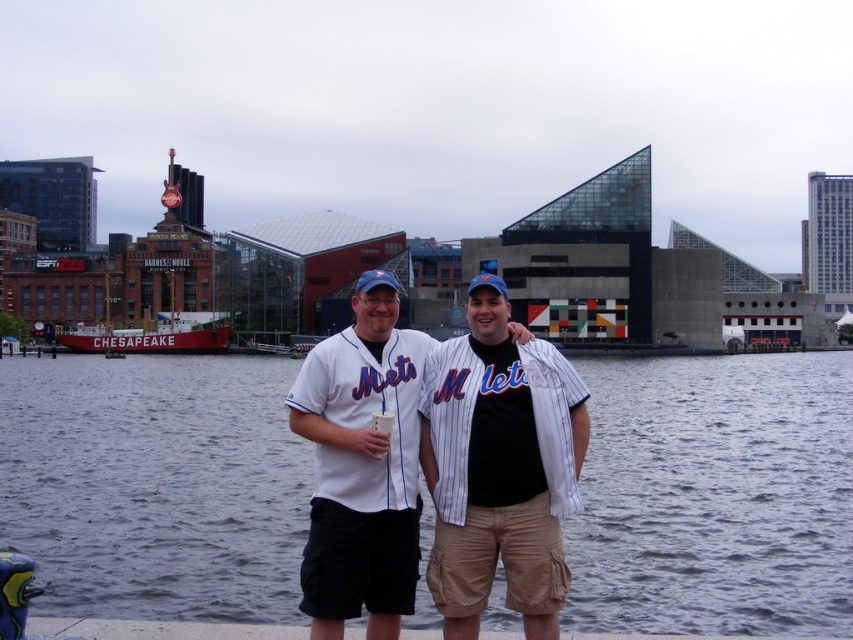
Question: Which of the following is the farthest from the observer?

Choices:
 (A) white pinstriped jersey at center
 (B) gray water at center
 (C) white pinstriped baseball uniform at center
 (D) white wooden boat at left

Answer: (D)

Question: Is white pinstriped baseball uniform at center to the left of white jersey at center from the viewer's perspective?

Choices:
 (A) yes
 (B) no

Answer: (B)

Question: Which object is closer to the camera taking this photo?

Choices:
 (A) white jersey at center
 (B) white pinstriped jersey at center
 (C) gray water at center

Answer: (B)

Question: Does white pinstriped baseball uniform at center appear under white jersey at center?

Choices:
 (A) yes
 (B) no

Answer: (B)

Question: Which point is farther to the camera?

Choices:
 (A) gray water at center
 (B) white jersey at center
 (C) white pinstriped baseball uniform at center
 (D) white wooden boat at left

Answer: (D)

Question: Is gray water at center to the left of white pinstriped jersey at center from the viewer's perspective?

Choices:
 (A) yes
 (B) no

Answer: (A)